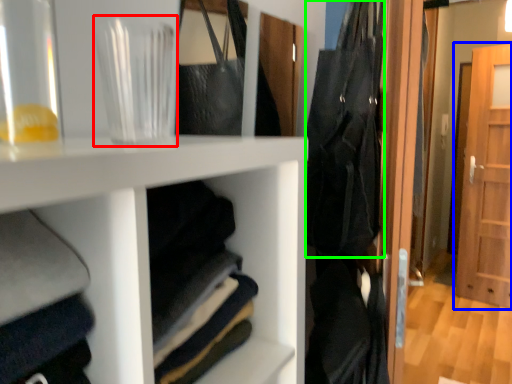
Question: Based on their relative distances, which object is nearer to glass vase (highlighted by a red box)? Choose from door (highlighted by a blue box) and clothing (highlighted by a green box).

Choices:
 (A) door
 (B) clothing

Answer: (B)